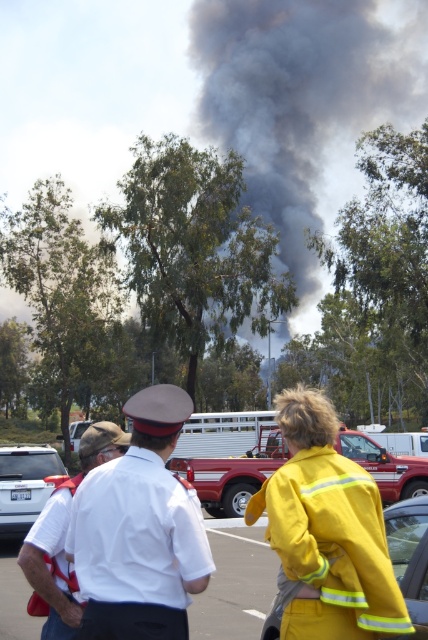
You are standing in the scene and see the white uniform shirt at center and the white plastic car at center. Which object is positioned to the right of the other?

The white uniform shirt at center is to the right of the white plastic car at center.

From the picture: You are standing at the point labeled as point (64, 538) in the image. Looking around, you see a white uniform shirt at center. What is the nearest object to your current position?

The nearest object to your current position at point (64, 538) is the white uniform shirt at center, as the point directly indicates its location.